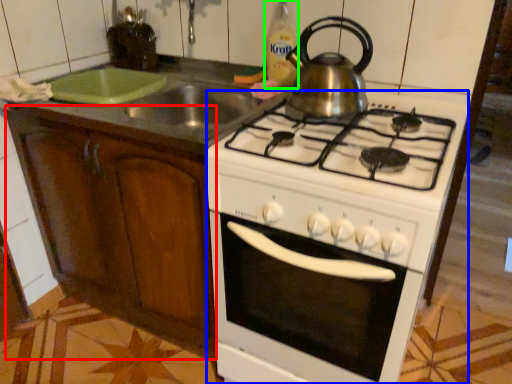
Question: Which object is positioned closest to cabinetry (highlighted by a red box)? Select from oven (highlighted by a blue box) and bottle (highlighted by a green box).

Choices:
 (A) oven
 (B) bottle

Answer: (A)